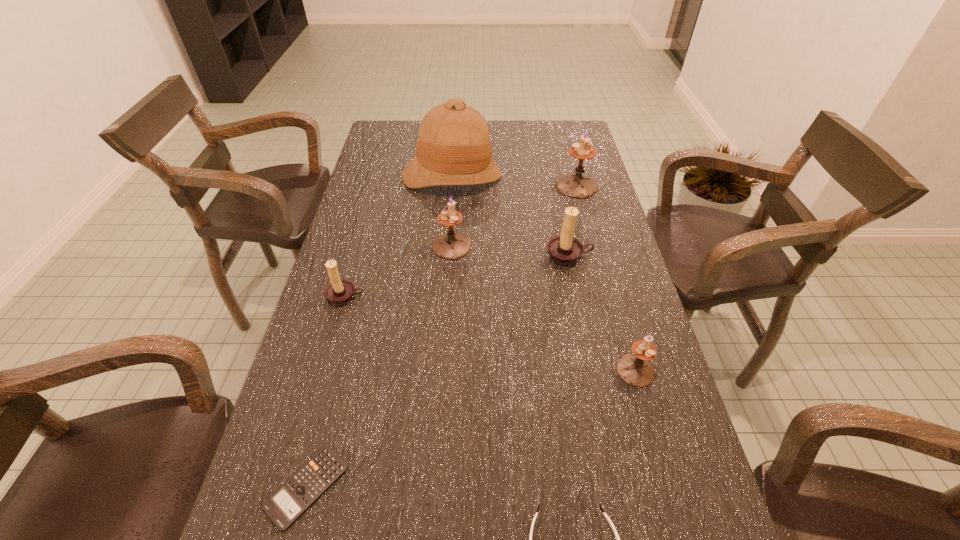
This screenshot has width=960, height=540. Identify the location of candle holder present at the left edge. (340, 291).

At what (x,y) coordinates should I click in order to perform the action: click on calculator present at the left edge. Please return your answer as a coordinate pair (x, y). This screenshot has height=540, width=960. Looking at the image, I should click on (305, 486).

Identify the location of vacant area at the far edge. Image resolution: width=960 pixels, height=540 pixels. (497, 139).

This screenshot has height=540, width=960. What are the coordinates of `blank space at the left edge of the desktop` in the screenshot? It's located at (297, 389).

You are a GUI agent. You are given a task and a screenshot of the screen. Output one action in this format:
    pyautogui.click(x=<x>, y=<y>)
    Task: Click on the vacant space at the right edge
    This screenshot has height=540, width=960.
    Given the screenshot: What is the action you would take?
    pyautogui.click(x=597, y=195)

Where is `free space at the far left corner of the desktop`? Image resolution: width=960 pixels, height=540 pixels. free space at the far left corner of the desktop is located at coordinates (387, 146).

In the image, there is a desktop. Where is `vacant space at the far right corner`? Image resolution: width=960 pixels, height=540 pixels. vacant space at the far right corner is located at coordinates (571, 146).

I want to click on free space between the leftmost candle holder and the smallest purple candle holder, so click(491, 333).

Locate an element on the screen. blank region between the tallest object and the farthest purple candle holder is located at coordinates pyautogui.click(x=515, y=181).

Where is `unoccupied area between the smallest purple candle holder and the tallest object`? unoccupied area between the smallest purple candle holder and the tallest object is located at coordinates (543, 273).